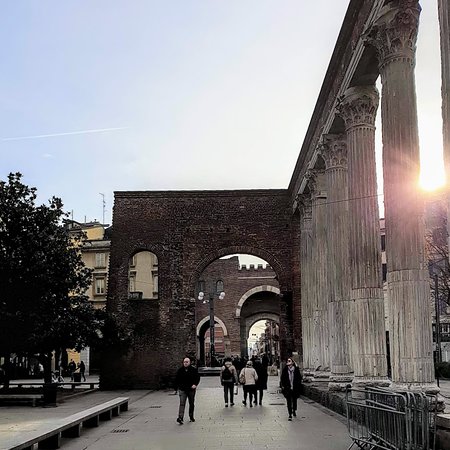
At what (x,y) coordinates should I click in order to perform the action: click on windows. Please return your answer as a coordinate pair (x, y). The image size is (450, 450). Looking at the image, I should click on (100, 258), (98, 285), (131, 286), (155, 282), (220, 287), (201, 287).